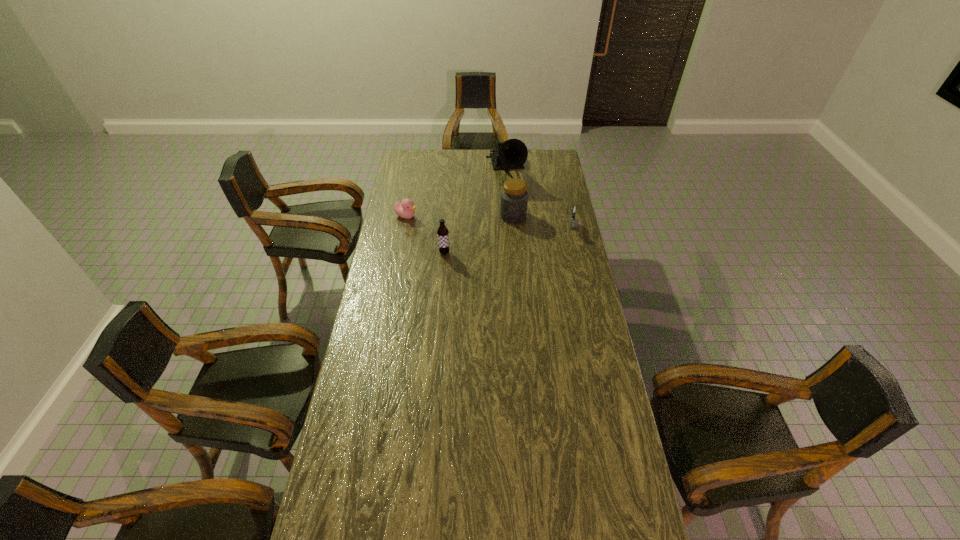
Locate an element on the screen. free space between the jar and the shortest object is located at coordinates (460, 216).

The image size is (960, 540). Identify the location of free area in between the second object from left to right and the duckling. (425, 234).

Where is `free spot between the igniter and the jar`? The height and width of the screenshot is (540, 960). free spot between the igniter and the jar is located at coordinates (542, 222).

Locate an element on the screen. The width and height of the screenshot is (960, 540). free spot between the farthest object and the rightmost object is located at coordinates (539, 200).

Select which object appears as the closest to the farthest object. Please provide its 2D coordinates. Your answer should be formatted as a tuple, i.e. [(x, y)], where the tuple contains the x and y coordinates of a point satisfying the conditions above.

[(514, 197)]

Identify which object is the third closest to the nearest object. Please provide its 2D coordinates. Your answer should be formatted as a tuple, i.e. [(x, y)], where the tuple contains the x and y coordinates of a point satisfying the conditions above.

[(512, 154)]

This screenshot has width=960, height=540. Identify the location of vacant point that satisfies the following two spatial constraints: 1. on the back side of the tallest object; 2. on the right side of the fourth object from right to left. (451, 171).